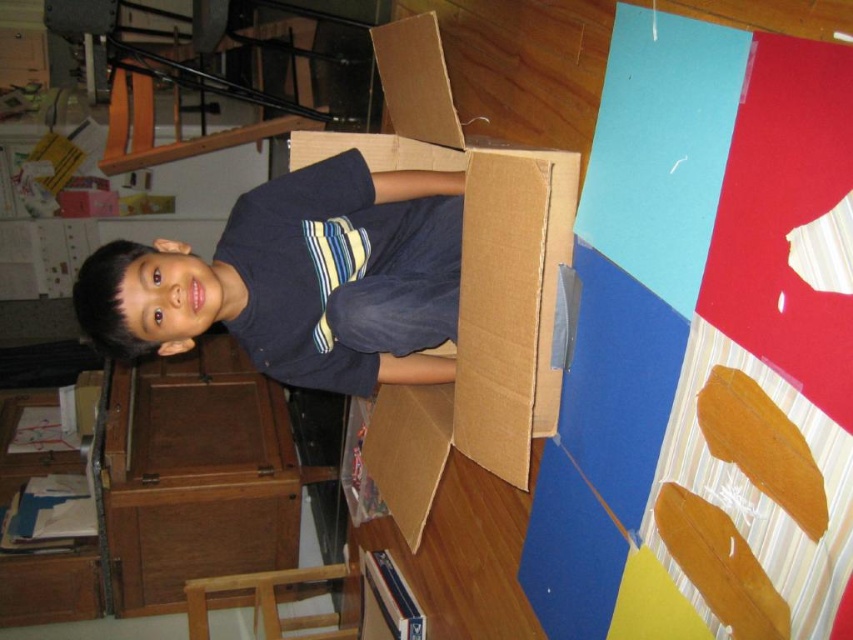
Question: Does dark blue shirt at center appear under cardboard box at center?

Choices:
 (A) no
 (B) yes

Answer: (A)

Question: Is dark blue shirt at center positioned at the back of cardboard box at center?

Choices:
 (A) yes
 (B) no

Answer: (A)

Question: Can you confirm if dark blue shirt at center is positioned below cardboard box at center?

Choices:
 (A) yes
 (B) no

Answer: (B)

Question: Which point is farther to the camera?

Choices:
 (A) (384, 484)
 (B) (415, 196)

Answer: (A)